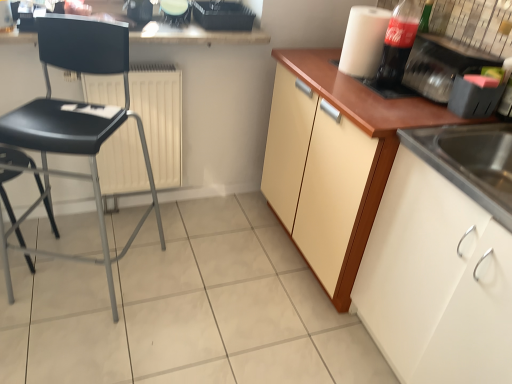
This screenshot has width=512, height=384. I want to click on vacant area in front of translucent plastic bottle at upper right, so coord(393,104).